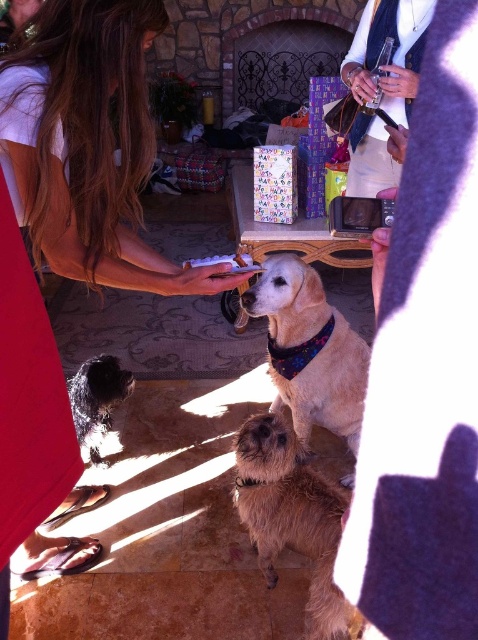
Can you confirm if golden fur dog at center is positioned to the left of black fuzzy dog at lower left?

No, golden fur dog at center is not to the left of black fuzzy dog at lower left.

Is golden fur dog at center bigger than black fuzzy dog at lower left?

Yes.

Measure the distance between golden fur dog at center and camera.

6.29 feet

Identify the location of golden fur dog at center. The height and width of the screenshot is (640, 478). 310,349.

Measure the distance between point (x=76, y=243) and camera.

Point (x=76, y=243) and camera are 4.58 feet apart.

Who is lower down, matte white shirt at center or white paper at center?

Positioned lower is white paper at center.

Does point (71, 125) lie in front of point (230, 259)?

Yes, point (71, 125) is in front of point (230, 259).

Locate an element on the screen. matte white shirt at center is located at coordinates (88, 145).

How much distance is there between matte white shirt at center and black fuzzy dog at lower left?

matte white shirt at center and black fuzzy dog at lower left are 39.26 inches apart.

Does matte white shirt at center have a smaller size compared to black fuzzy dog at lower left?

No.

In the scene shown: Who is more forward, (166,289) or (96,369)?

Point (166,289) is in front.

Where is `matte white shirt at center`? Image resolution: width=478 pixels, height=640 pixels. matte white shirt at center is located at coordinates (88, 145).